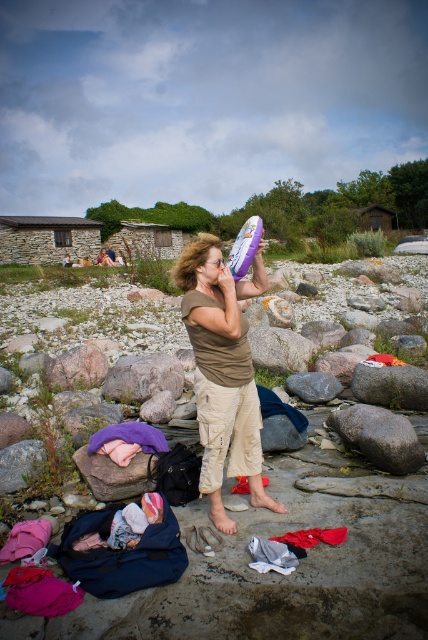
Question: Which point is closer to the camera taking this photo?

Choices:
 (A) (332, 541)
 (B) (360, 365)
 (C) (294, 380)

Answer: (A)

Question: Does smooth gray rock at center-right appear on the right side of white cotton clothes at center?

Choices:
 (A) yes
 (B) no

Answer: (A)

Question: Which point appears farthest from the camera in this image?

Choices:
 (A) (231, 452)
 (B) (323, 387)
 (C) (82, 358)
 (D) (299, 538)

Answer: (C)

Question: Is gray rough rock at center to the right of gray smooth rock at center from the viewer's perspective?

Choices:
 (A) no
 (B) yes

Answer: (A)

Question: Does smooth gray rock at center-right have a greater width compared to gray rock at center?

Choices:
 (A) no
 (B) yes

Answer: (A)

Question: Based on their relative distances, which object is nearer to the brown cotton shirt at center?

Choices:
 (A) smooth gray rock at center-right
 (B) gray smooth rock at center
 (C) gray rock at center

Answer: (A)